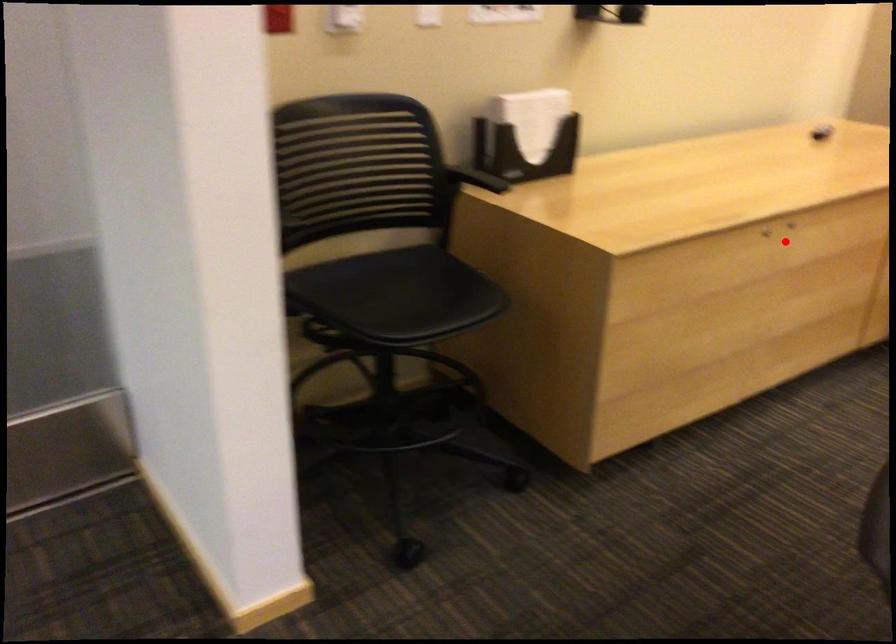
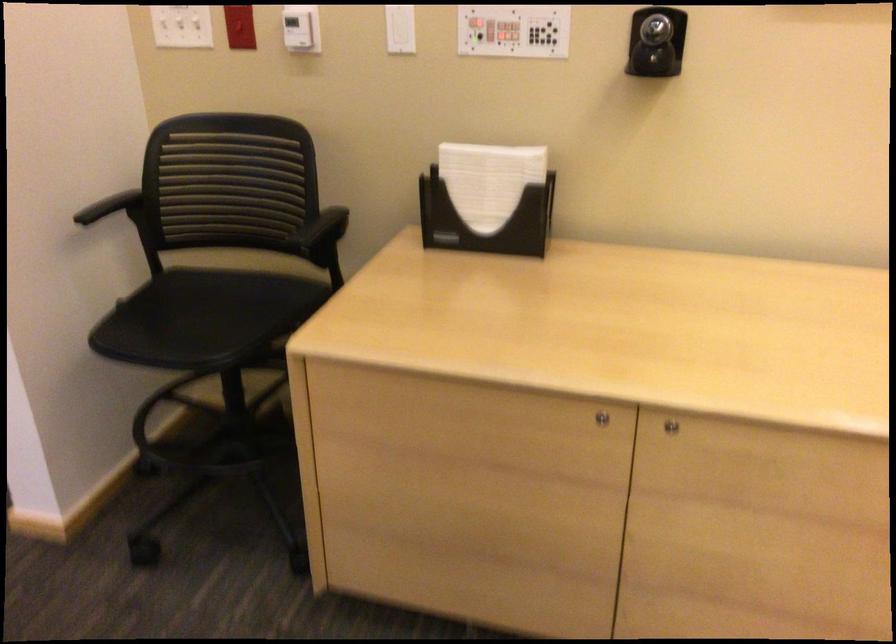
Question: I am providing you with two images of the same scene from different viewpoints. In image1, a red point is highlighted. Considering the same 3D point in image2, which of the following is correct?

Choices:
 (A) It is closer
 (B) It is farther

Answer: (A)